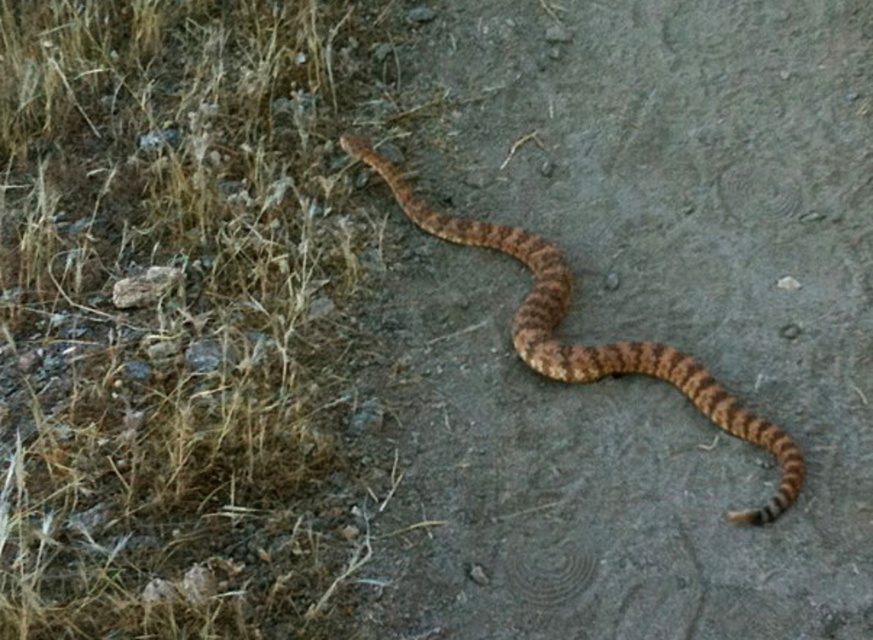
Is point (277, 400) positioned before point (760, 445)?

No.

This screenshot has width=873, height=640. What are the coordinates of `brown dry grass at upper left` in the screenshot? It's located at (184, 317).